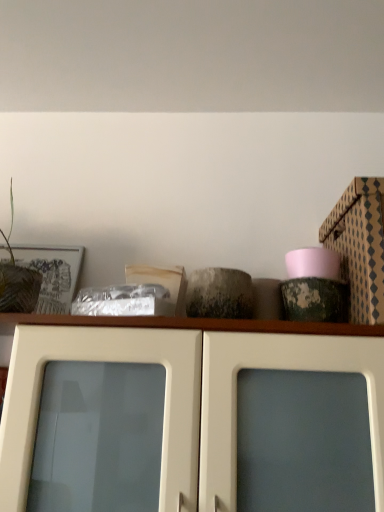
Question: Is point (130, 497) positioned closer to the camera than point (380, 224)?

Choices:
 (A) closer
 (B) farther

Answer: (A)

Question: Considering the positions of white glossy cabinet doors at center and patterned cardboard box at upper right in the image, is white glossy cabinet doors at center wider or thinner than patterned cardboard box at upper right?

Choices:
 (A) wide
 (B) thin

Answer: (A)

Question: Which object is positioned farthest from the white glossy cabinet doors at center?

Choices:
 (A) green leafy plant at left
 (B) patterned cardboard box at upper right

Answer: (A)

Question: Which is nearer to the green leafy plant at left?

Choices:
 (A) patterned cardboard box at upper right
 (B) white glossy cabinet doors at center

Answer: (B)